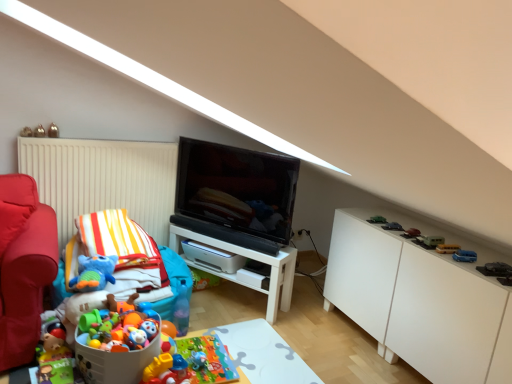
The width and height of the screenshot is (512, 384). Find the location of `vacant point to the left of metallic gray car at right, the first toy in the right-to-left sequence`. vacant point to the left of metallic gray car at right, the first toy in the right-to-left sequence is located at coordinates (466, 262).